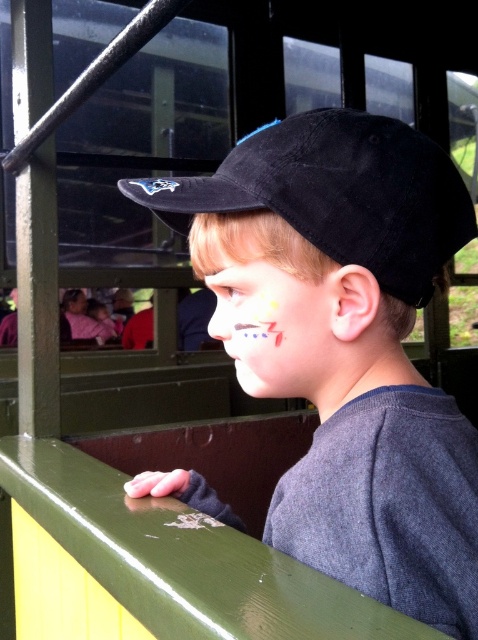
Question: Can you confirm if black suede baseball cap at center is wider than matte paint face at center?

Choices:
 (A) yes
 (B) no

Answer: (A)

Question: Which object is farther from the camera taking this photo?

Choices:
 (A) black suede baseball cap at center
 (B) matte black cap at center
 (C) matte paint face at center

Answer: (C)

Question: Does matte black cap at center appear on the right side of black suede baseball cap at center?

Choices:
 (A) yes
 (B) no

Answer: (B)

Question: Which of the following is the closest to the observer?

Choices:
 (A) black suede baseball cap at center
 (B) matte paint face at center

Answer: (A)

Question: From the image, what is the correct spatial relationship of black suede baseball cap at center in relation to matte paint face at center?

Choices:
 (A) left
 (B) right

Answer: (B)

Question: Which of the following is the closest to the observer?

Choices:
 (A) (248, 381)
 (B) (371, 241)

Answer: (B)